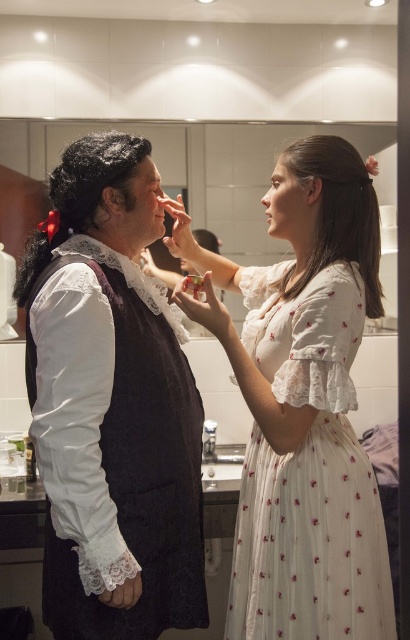
You are a costume designer in a theater preparing for a play. You have a white floral fabric dress at center and a glossy white mirror at upper center. Which object is taller?

The white floral fabric dress at center is taller than the glossy white mirror at upper center.

You are a costume designer working in this bathroom and need to adjust the white floral fabric dress at center. The glossy white mirror at upper center is your only reflective surface. Can you comfortably reach the dress while standing in front of the mirror?

The white floral fabric dress at center and glossy white mirror at upper center are 1.30 meters apart. Since the distance between them is 1.30 meters, a typical person can comfortably reach the dress while standing in front of the mirror.

You are a costume designer assessing the spatial compatibility of two garments in a bathroom scene. Given the matte black vest at left and the white floral fabric dress at center, which garment reaches a higher point in the scene?

The matte black vest at left reaches a higher point in the scene compared to the white floral fabric dress at center as stated in the objects description.